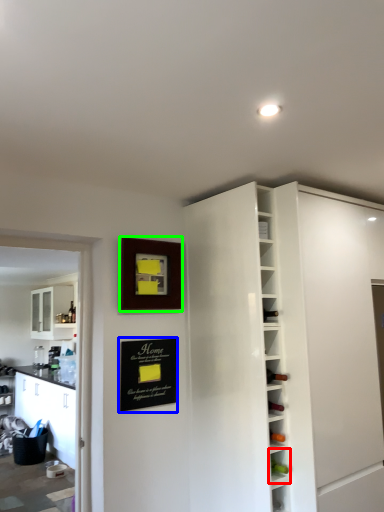
Question: Which object is positioned closest to shelf (highlighted by a red box)? Select from bulletin board (highlighted by a blue box) and picture frame (highlighted by a green box).

Choices:
 (A) bulletin board
 (B) picture frame

Answer: (A)